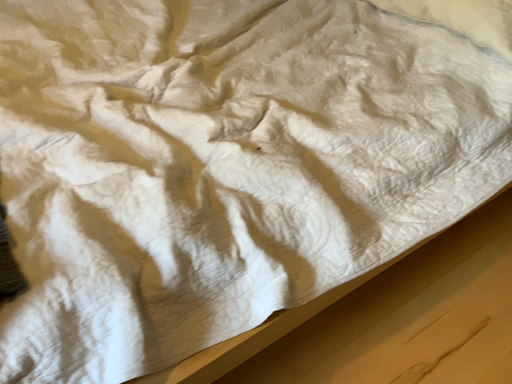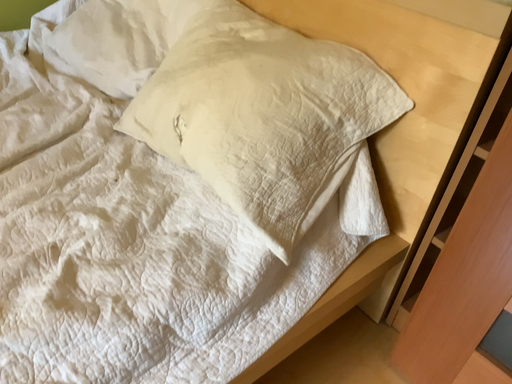
Question: Which way did the camera rotate in the video?

Choices:
 (A) rotated upward
 (B) rotated downward

Answer: (A)